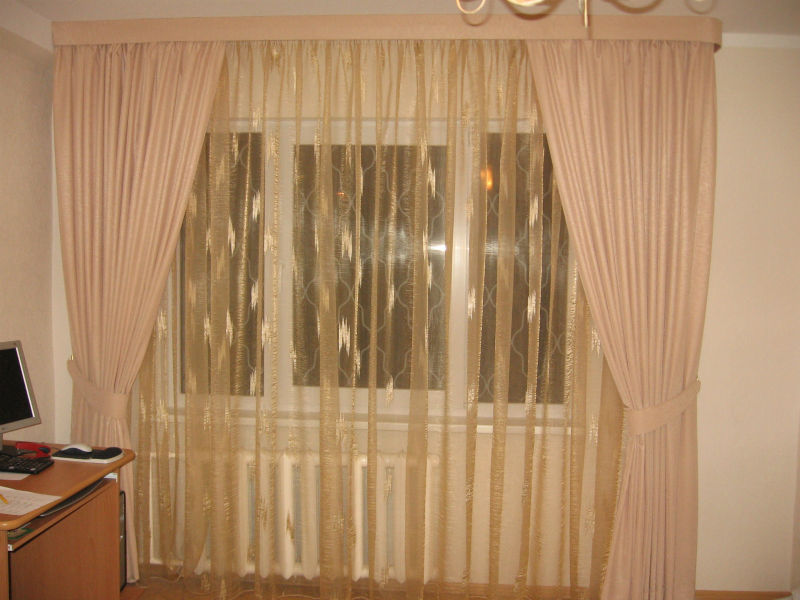
The height and width of the screenshot is (600, 800). In order to click on sheet of paper in this screenshot , I will do `click(17, 504)`.